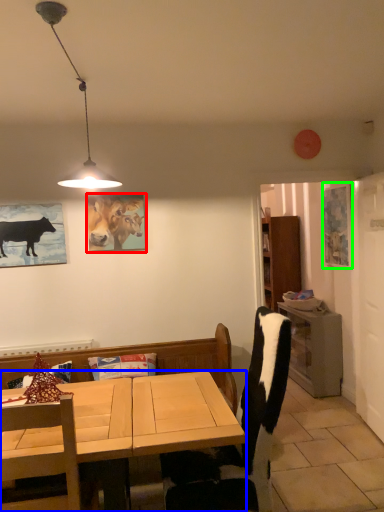
Question: Which object is the farthest from picture frame (highlighted by a red box)? Choose among these: desk (highlighted by a blue box) or picture frame (highlighted by a green box).

Choices:
 (A) desk
 (B) picture frame

Answer: (B)